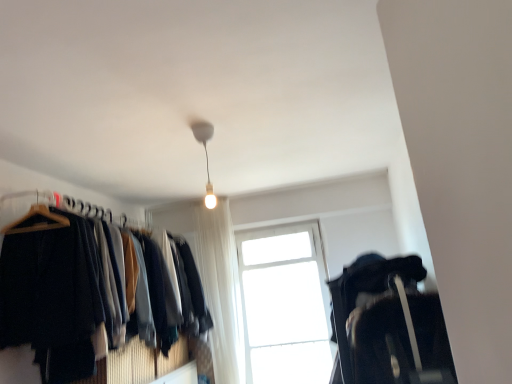
Image resolution: width=512 pixels, height=384 pixels. What do you see at coordinates (220, 287) in the screenshot?
I see `white sheer curtain at center` at bounding box center [220, 287].

This screenshot has width=512, height=384. Identify the location of matte black hangers at left, the 1th closet when ordered from left to right. (67, 282).

Measure the distance between point (349, 308) and camera.

Point (349, 308) is 2.46 meters from camera.

What do you see at coordinates (206, 156) in the screenshot? I see `matte white bulb at upper center` at bounding box center [206, 156].

At what (x,y) coordinates should I click in order to perform the action: click on white sheer curtain at center. Please return your answer as a coordinate pair (x, y). The image size is (512, 384). Looking at the image, I should click on (220, 287).

Is black fabric suitcase at lower right, the 2th closet viewed from the left, not inside matte black hangers at left, the 2th closet from the right?

black fabric suitcase at lower right, the 2th closet viewed from the left, is positioned outside matte black hangers at left, the 2th closet from the right.

Considering the relative sizes of black fabric suitcase at lower right, placed as the 1th closet when sorted from right to left, and matte black hangers at left, the 1th closet when ordered from left to right, in the image provided, is black fabric suitcase at lower right, placed as the 1th closet when sorted from right to left, shorter than matte black hangers at left, the 1th closet when ordered from left to right,?

Yes.

From the image's perspective, is black fabric suitcase at lower right, the 2th closet viewed from the left, on matte black hangers at left, the 2th closet from the right?

Yes, from the image's perspective, black fabric suitcase at lower right, the 2th closet viewed from the left, is on top of matte black hangers at left, the 2th closet from the right.

In order to click on window lying behind the matte black hangers at left, the 1th closet when ordered from left to right in this screenshot , I will do `click(285, 305)`.

Is transparent glass window at center completely or partially inside matte black hangers at left, the 2th closet from the right?

No, transparent glass window at center is not surrounded by matte black hangers at left, the 2th closet from the right.

Which is behind, matte black hangers at left, the 1th closet when ordered from left to right, or transparent glass window at center?

Positioned behind is transparent glass window at center.

From a real-world perspective, is matte black hangers at left, the 2th closet from the right, on top of transparent glass window at center?

Yes, from a real-world perspective, matte black hangers at left, the 2th closet from the right, is on top of transparent glass window at center.

Which is in front, point (219, 318) or point (61, 244)?

The point (61, 244) is closer.

From a real-world perspective, is white sheer curtain at center positioned above or below matte black hangers at left, the 2th closet from the right?

→ In terms of real-world spatial position, white sheer curtain at center is below matte black hangers at left, the 2th closet from the right.

How many degrees apart are the facing directions of white sheer curtain at center and matte black hangers at left, the 2th closet from the right?

They differ by 89.7 degrees in their facing directions.

Considering the positions of objects white sheer curtain at center and matte black hangers at left, the 2th closet from the right, in the image provided, who is in front, white sheer curtain at center or matte black hangers at left, the 2th closet from the right,?

matte black hangers at left, the 2th closet from the right, is closer to the camera.

From the image's perspective, who appears lower, matte white bulb at upper center or white sheer curtain at center?

From the image's view, white sheer curtain at center is below.

Can you see matte white bulb at upper center touching white sheer curtain at center?

matte white bulb at upper center and white sheer curtain at center are not in contact.

In the scene shown: Considering the positions of objects matte white bulb at upper center and white sheer curtain at center in the image provided, who is more to the left, matte white bulb at upper center or white sheer curtain at center?

Positioned to the left is white sheer curtain at center.

Is matte white bulb at upper center looking in the opposite direction of white sheer curtain at center?

matte white bulb at upper center is not turned away from white sheer curtain at center.

Considering the relative sizes of matte white bulb at upper center and matte black hangers at left, the 1th closet when ordered from left to right, in the image provided, is matte white bulb at upper center bigger than matte black hangers at left, the 1th closet when ordered from left to right,?

Incorrect, matte white bulb at upper center is not larger than matte black hangers at left, the 1th closet when ordered from left to right.

Which object is more forward, matte white bulb at upper center or matte black hangers at left, the 2th closet from the right?

matte black hangers at left, the 2th closet from the right, is closer to the camera.

Considering the sizes of matte white bulb at upper center and matte black hangers at left, the 1th closet when ordered from left to right, in the image, is matte white bulb at upper center wider or thinner than matte black hangers at left, the 1th closet when ordered from left to right,?

Considering their sizes, matte white bulb at upper center looks slimmer than matte black hangers at left, the 1th closet when ordered from left to right.

Who is shorter, matte white bulb at upper center or matte black hangers at left, the 1th closet when ordered from left to right?

matte white bulb at upper center.

From the image's perspective, which one is positioned lower, matte black hangers at left, the 1th closet when ordered from left to right, or black fabric suitcase at lower right, the 2th closet viewed from the left?

From the image's view, matte black hangers at left, the 1th closet when ordered from left to right, is below.

Could you tell me if matte black hangers at left, the 1th closet when ordered from left to right, is facing black fabric suitcase at lower right, the 2th closet viewed from the left?

Yes, matte black hangers at left, the 1th closet when ordered from left to right, is turned towards black fabric suitcase at lower right, the 2th closet viewed from the left.

Between matte black hangers at left, the 1th closet when ordered from left to right, and black fabric suitcase at lower right, the 2th closet viewed from the left, which one has smaller width?

With smaller width is black fabric suitcase at lower right, the 2th closet viewed from the left.

Relative to black fabric suitcase at lower right, the 2th closet viewed from the left, is transparent glass window at center in front or behind?

transparent glass window at center is positioned farther from the viewer than black fabric suitcase at lower right, the 2th closet viewed from the left.

From the image's perspective, which is below, transparent glass window at center or black fabric suitcase at lower right, placed as the 1th closet when sorted from right to left?

transparent glass window at center is shown below in the image.

Does point (281, 304) come farther from viewer compared to point (420, 276)?

Yes, point (281, 304) is behind point (420, 276).

In the scene shown: Is transparent glass window at center not inside black fabric suitcase at lower right, placed as the 1th closet when sorted from right to left?

Yes, transparent glass window at center is outside of black fabric suitcase at lower right, placed as the 1th closet when sorted from right to left.

Where is `closet above the matte black hangers at left, the 2th closet from the right (from the image's perspective)`? Image resolution: width=512 pixels, height=384 pixels. closet above the matte black hangers at left, the 2th closet from the right (from the image's perspective) is located at coordinates (386, 321).

I want to click on closet located above the transparent glass window at center (from a real-world perspective), so click(x=67, y=282).

Estimate the real-world distances between objects in this image. Which object is closer to white sheer curtain at center, matte white bulb at upper center or transparent glass window at center?

Among the two, transparent glass window at center is located nearer to white sheer curtain at center.

From the picture: Which object lies nearer to the anchor point matte white bulb at upper center, matte black hangers at left, the 2th closet from the right, or transparent glass window at center?

Among the two, matte black hangers at left, the 2th closet from the right, is located nearer to matte white bulb at upper center.

When comparing their distances from white sheer curtain at center, does black fabric suitcase at lower right, placed as the 1th closet when sorted from right to left, or transparent glass window at center seem further?

black fabric suitcase at lower right, placed as the 1th closet when sorted from right to left, is further to white sheer curtain at center.

Consider the image. Based on their spatial positions, is black fabric suitcase at lower right, the 2th closet viewed from the left, or transparent glass window at center closer to matte white bulb at upper center?

black fabric suitcase at lower right, the 2th closet viewed from the left, is closer to matte white bulb at upper center.

Considering their positions, is black fabric suitcase at lower right, the 2th closet viewed from the left, positioned closer to matte black hangers at left, the 1th closet when ordered from left to right, than transparent glass window at center?

Among the two, black fabric suitcase at lower right, the 2th closet viewed from the left, is located nearer to matte black hangers at left, the 1th closet when ordered from left to right.

Based on their spatial positions, is transparent glass window at center or matte white bulb at upper center closer to black fabric suitcase at lower right, placed as the 1th closet when sorted from right to left?

Based on the image, matte white bulb at upper center appears to be nearer to black fabric suitcase at lower right, placed as the 1th closet when sorted from right to left.

Looking at the image, which one is located further to matte white bulb at upper center, white sheer curtain at center or matte black hangers at left, the 1th closet when ordered from left to right?

The object further to matte white bulb at upper center is white sheer curtain at center.

Considering their positions, is matte white bulb at upper center positioned further to matte black hangers at left, the 2th closet from the right, than black fabric suitcase at lower right, the 2th closet viewed from the left?

The object further to matte black hangers at left, the 2th closet from the right, is black fabric suitcase at lower right, the 2th closet viewed from the left.

What are the coordinates of `curtain between black fabric suitcase at lower right, placed as the 1th closet when sorted from right to left, and transparent glass window at center from front to back` in the screenshot? It's located at (220, 287).

I want to click on lamp between matte black hangers at left, the 2th closet from the right, and black fabric suitcase at lower right, placed as the 1th closet when sorted from right to left, from left to right, so click(206, 156).

Where is `lamp between matte black hangers at left, the 1th closet when ordered from left to right, and transparent glass window at center in the front-back direction`? lamp between matte black hangers at left, the 1th closet when ordered from left to right, and transparent glass window at center in the front-back direction is located at coordinates (206, 156).

Locate an element on the screen. This screenshot has height=384, width=512. lamp between black fabric suitcase at lower right, the 2th closet viewed from the left, and transparent glass window at center, along the z-axis is located at coordinates (206, 156).